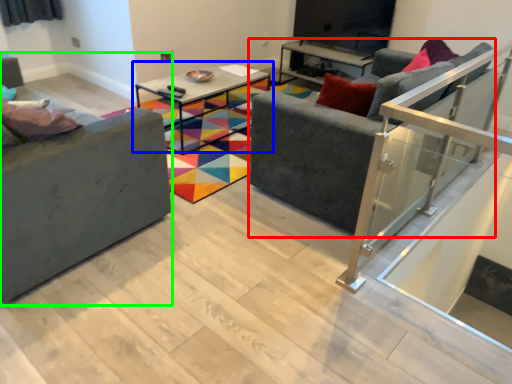
Question: Which object is the closest to the studio couch (highlighted by a red box)? Choose among these: table (highlighted by a blue box) or studio couch (highlighted by a green box).

Choices:
 (A) table
 (B) studio couch

Answer: (B)